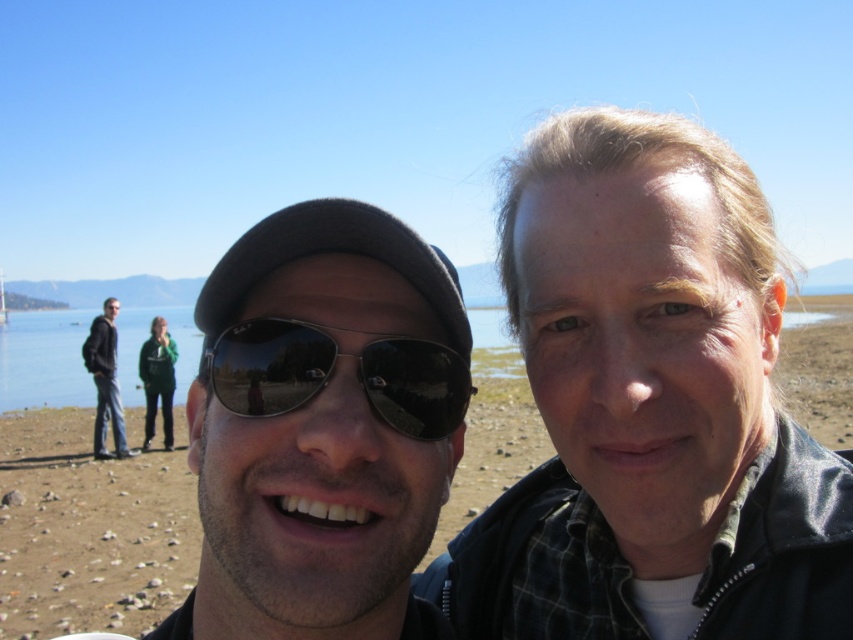
You are planning to build a sandcastle on the beach. Given the presence of brown sand at center and clear blue water at center, which material would be more suitable for constructing a stable sandcastle, and why?

The brown sand at center is more suitable for constructing a stable sandcastle because its width is larger than the clear blue water at center, providing a more stable base.

You are a photographer trying to capture a closeup of the matte black sunglasses at center and the black reflective sunglasses at center. Which one is located to the left of the other?

The matte black sunglasses at center is positioned on the left side of black reflective sunglasses at center.